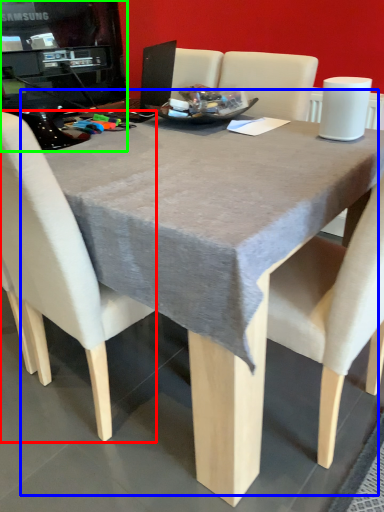
Question: Which is farther away from chair (highlighted by a red box)? table (highlighted by a blue box) or desktop computer (highlighted by a green box)?

Choices:
 (A) table
 (B) desktop computer

Answer: (B)